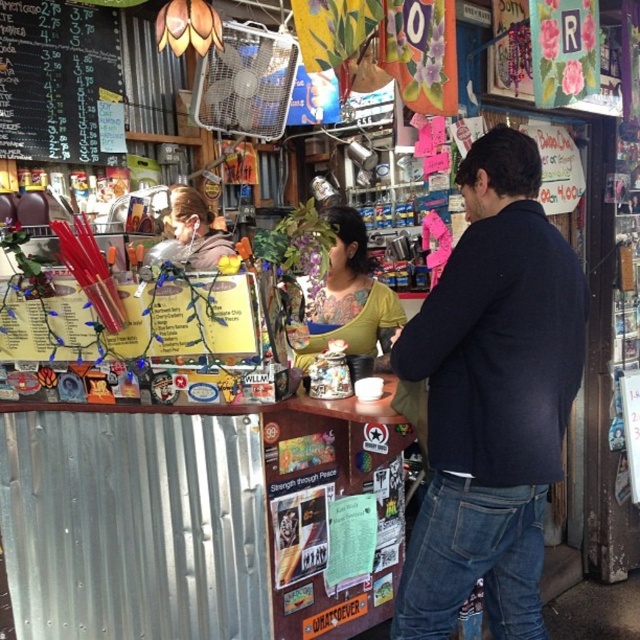
You are standing at the camera position and want to see the black chalkboard menu at upper left. Is it possible to see the menu without moving your head?

The black chalkboard menu at upper left and camera are 11.24 feet apart from each other, so yes, it is possible to see the menu without moving your head as the distance is sufficient for visibility.

You are standing at point (x=378, y=317) and want to move to the exit located at point (x=33, y=99). Is the exit directly in front of you or behind you?

The exit at point (x=33, y=99) is behind point (x=378, y=317), so the exit is behind you.